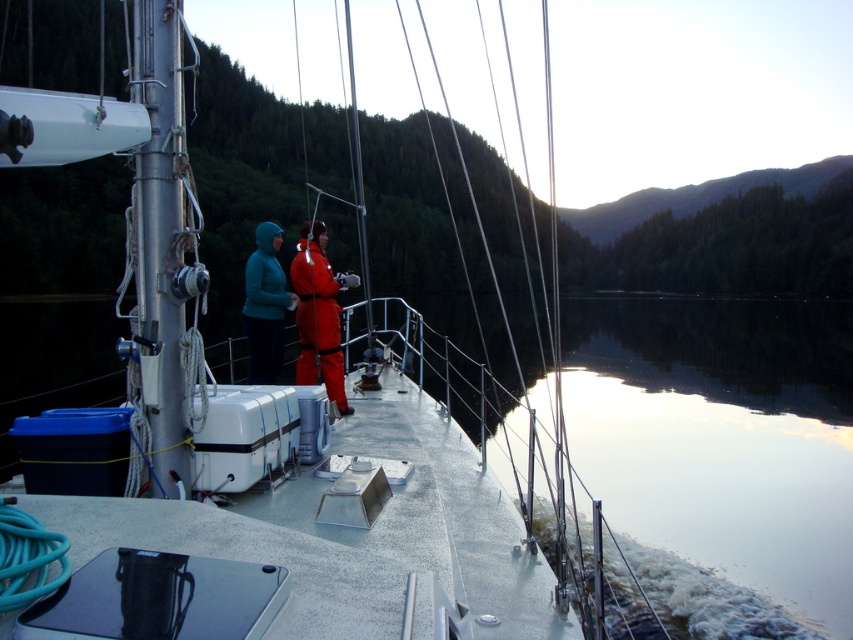
You are a photographer on the deck of a sailboat trying to capture both the matte orange jumpsuit at center and the matte blue jacket at center in a single frame. Given their sizes, which one might you need to position closer to the camera to ensure both appear similarly sized in the photo?

Since the matte orange jumpsuit at center is larger in size than the matte blue jacket at center, you would need to move the matte orange jumpsuit at center further away from the camera and bring the matte blue jacket at center closer. This way, their apparent sizes in the photo will balance out.

You are standing at the point marked as point (321, 364) on the sailboat deck. If you want to take a photo of the entire deck and its surroundings, would the camera positioned at the current location be able to capture everything in one shot? Explain your reasoning based on the distance between the camera and the point.

The camera is 7.09 meters away from point (321, 364). Since the camera is positioned at the point itself, the distance should be zero. The discrepancy suggests an error in the provided information. Assuming the camera is at the given point, it can capture the entire deck and surroundings in one shot as long as the lens has an appropriate wide angle.